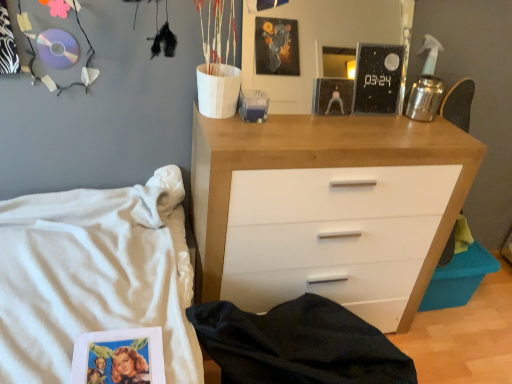
This screenshot has width=512, height=384. Identify the location of blank space situated above white wood chest of drawers at center (from a real-world perspective). (344, 124).